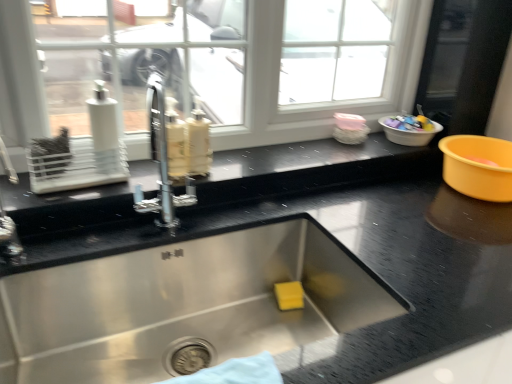
Question: Considering their positions, is black granite countertop at center located in front of or behind white plastic basin at upper right?

Choices:
 (A) behind
 (B) front

Answer: (B)

Question: Considering the relative positions of black granite countertop at center and white plastic basin at upper right in the image provided, is black granite countertop at center to the left or to the right of white plastic basin at upper right?

Choices:
 (A) right
 (B) left

Answer: (B)

Question: Looking at the image, does black granite countertop at center seem bigger or smaller compared to white plastic basin at upper right?

Choices:
 (A) big
 (B) small

Answer: (A)

Question: Considering the positions of white plastic basin at upper right and black granite countertop at center in the image, is white plastic basin at upper right bigger or smaller than black granite countertop at center?

Choices:
 (A) big
 (B) small

Answer: (B)

Question: Do you think white plastic basin at upper right is within black granite countertop at center, or outside of it?

Choices:
 (A) outside
 (B) inside

Answer: (A)

Question: Looking at their shapes, would you say white plastic basin at upper right is wider or thinner than black granite countertop at center?

Choices:
 (A) thin
 (B) wide

Answer: (A)

Question: From a real-world perspective, relative to black granite countertop at center, is white plastic basin at upper right vertically above or below?

Choices:
 (A) above
 (B) below

Answer: (A)